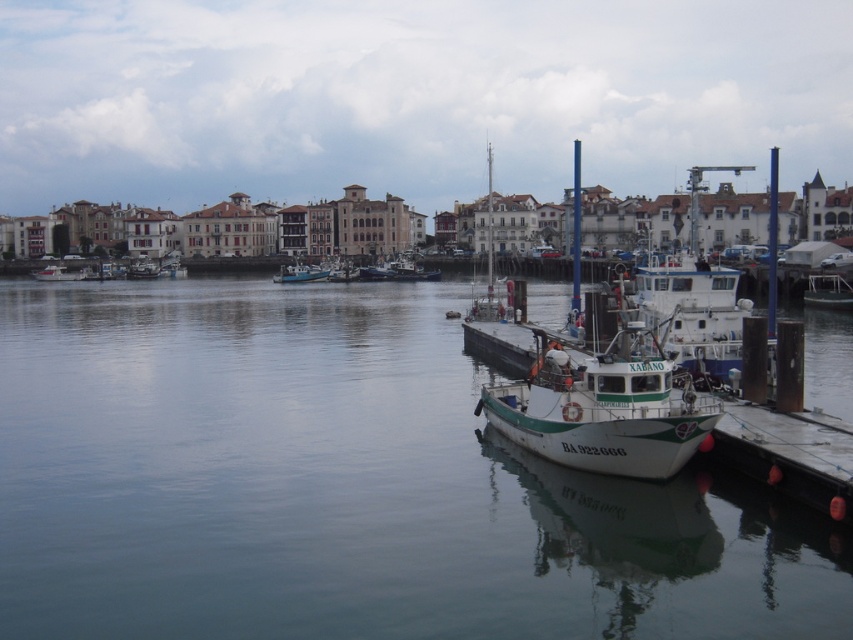
You are a harbor worker who needs to move a 20 meter long cargo container from the white matte boat at center to the dock. Can you safely move the container without it hitting the clear water at center?

The distance between the white matte boat at center and the clear water at center is 21.97 meters. Since the cargo container is 20 meters long, there is enough space to safely move it without hitting the clear water at center.

You are standing on the wooden dock and want to walk to the point that is closer to you. Which point should you walk towards, point (x=810, y=275) or point (x=357, y=266)?

You should walk towards point (x=810, y=275) because it is closer to the viewer than point (x=357, y=266).